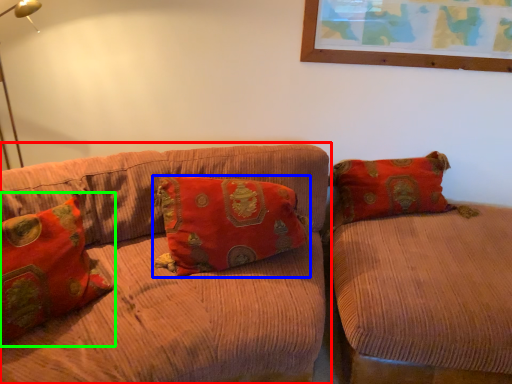
Question: Which object is the closest to the studio couch (highlighted by a red box)? Choose among these: pillow (highlighted by a blue box) or pillow (highlighted by a green box).

Choices:
 (A) pillow
 (B) pillow

Answer: (A)